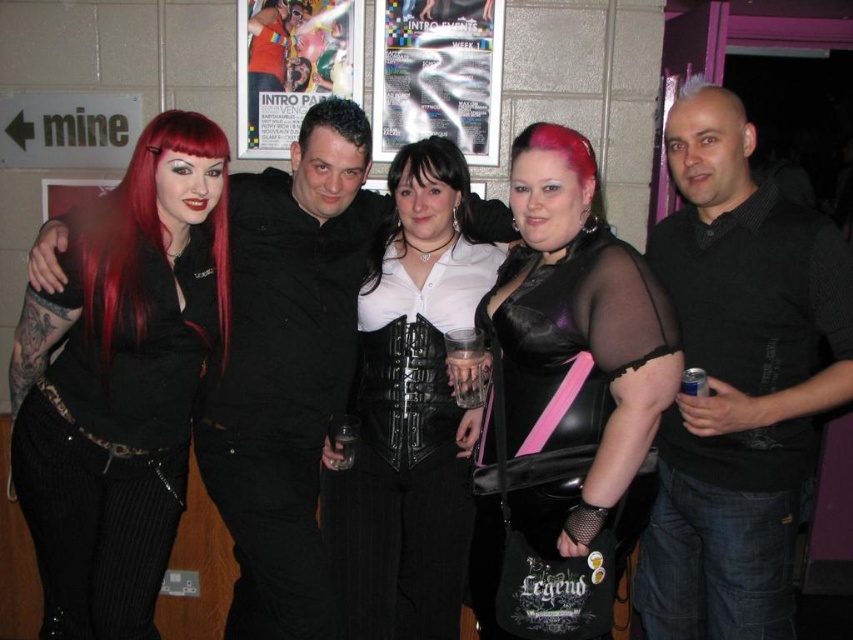
You are a photographer at the event and need to adjust the lighting between the matte black top at left and the black leather dress at center. The minimum distance required for your equipment to work properly is 34 inches. Based on the scene, can your equipment effectively illuminate both objects without interference?

The matte black top at left is 33.53 inches from the black leather dress at center. Since the required minimum distance is 34 inches, the equipment cannot effectively illuminate both objects without interference because they are too close.

You are a photographer trying to capture the group of five individuals at the social event. You notice a matte black top at left located at point (120, 381). Where should you position your camera to ensure the matte black top at left is centered in your shot?

To center the matte black top at left located at point (120, 381), position the camera directly facing that coordinate, ensuring the crosshairs of your viewfinder align with the coordinates provided.